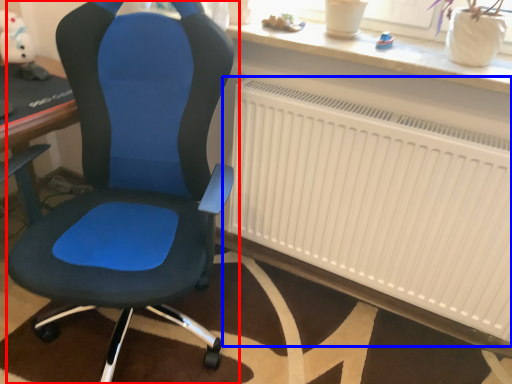
Question: Which object appears closest to the camera in this image, chair (highlighted by a red box) or radiator (highlighted by a blue box)?

Choices:
 (A) chair
 (B) radiator

Answer: (A)